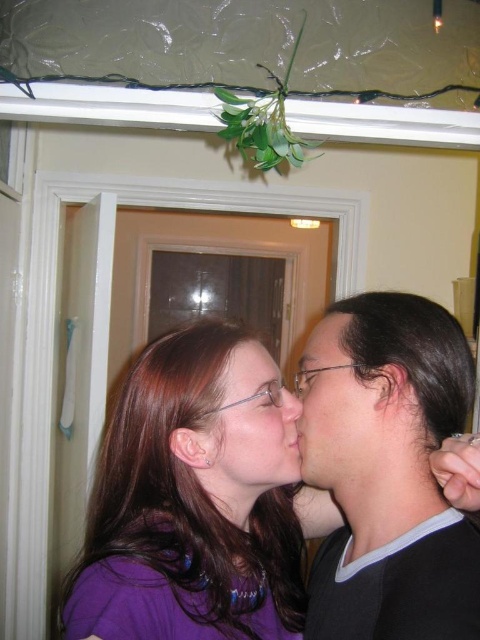
Question: Where is purple matte shirt at center located in relation to black matte hair at right in the image?

Choices:
 (A) right
 (B) left

Answer: (B)

Question: Is matte black face at center smaller than matte black hair at center?

Choices:
 (A) no
 (B) yes

Answer: (A)

Question: Which point is closer to the camera taking this photo?

Choices:
 (A) pyautogui.click(x=252, y=348)
 (B) pyautogui.click(x=347, y=449)

Answer: (B)

Question: Can you confirm if matte black face at center is thinner than matte purple shirt at center?

Choices:
 (A) yes
 (B) no

Answer: (A)

Question: Which object is positioned closest to the matte black face at center?

Choices:
 (A) purple matte shirt at center
 (B) matte black hair at center

Answer: (B)

Question: Estimate the real-world distances between objects in this image. Which object is farther from the matte black hair at center?

Choices:
 (A) purple matte shirt at center
 (B) matte purple shirt at center
 (C) black matte hair at right

Answer: (A)